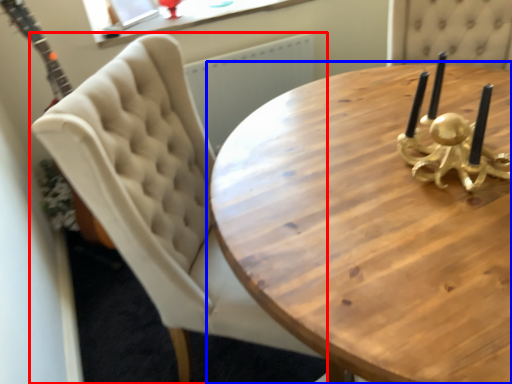
Question: Which of the following is the farthest to the observer, chair (highlighted by a red box) or coffee table (highlighted by a blue box)?

Choices:
 (A) chair
 (B) coffee table

Answer: (A)